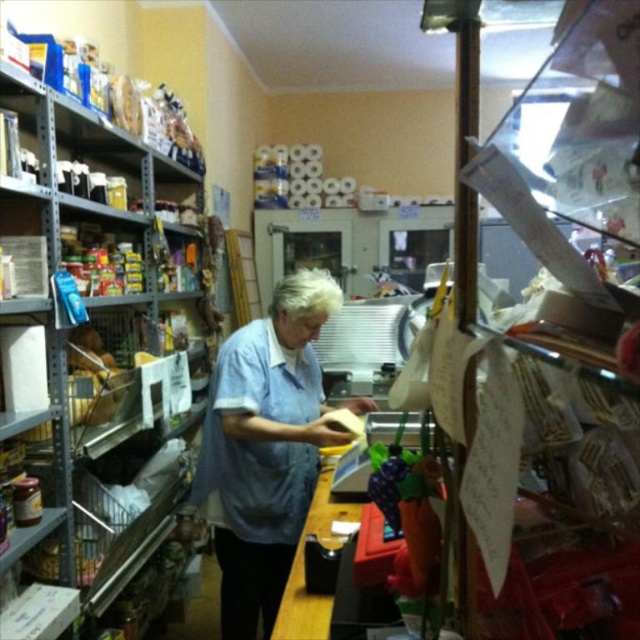
Question: Which object appears farthest from the camera in this image?

Choices:
 (A) blue cotton shirt at center
 (B) metallic silver shelves at left

Answer: (A)

Question: Among these points, which one is nearest to the camera?

Choices:
 (A) (19, 413)
 (B) (273, 520)

Answer: (A)

Question: Does metallic silver shelves at left have a lesser width compared to blue cotton shirt at center?

Choices:
 (A) no
 (B) yes

Answer: (B)

Question: Can you confirm if metallic silver shelves at left is positioned to the right of blue cotton shirt at center?

Choices:
 (A) yes
 (B) no

Answer: (B)

Question: Does metallic silver shelves at left appear on the left side of blue cotton shirt at center?

Choices:
 (A) no
 (B) yes

Answer: (B)